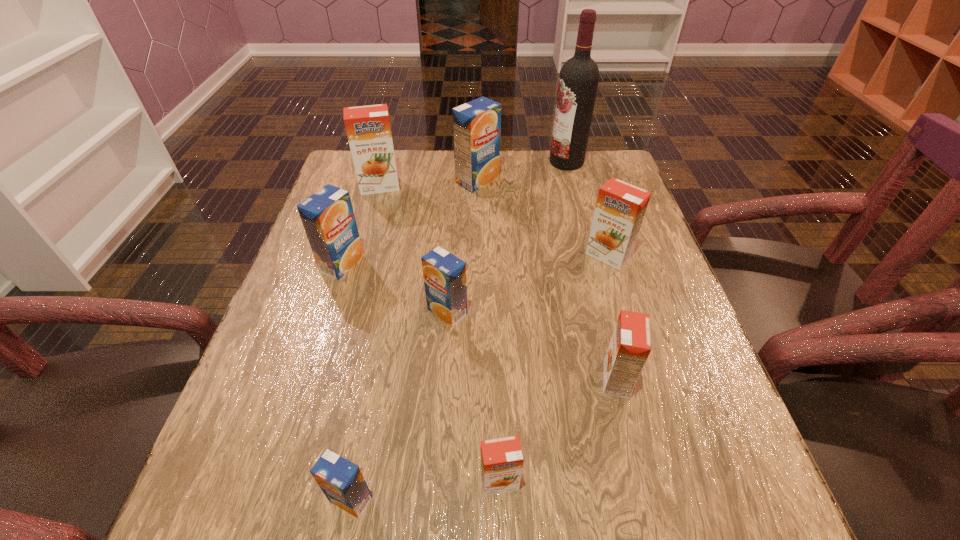
This screenshot has height=540, width=960. Find the location of `free space at the far edge of the desktop`. free space at the far edge of the desktop is located at coordinates (422, 190).

In the image, there is a desktop. What are the coordinates of `blank space at the left edge` in the screenshot? It's located at (305, 289).

Find the location of `vacant space at the right edge of the desktop`. vacant space at the right edge of the desktop is located at coordinates (641, 240).

Find the location of a particular element. Image resolution: width=960 pixels, height=540 pixels. vacant area at the far left corner is located at coordinates (342, 188).

Locate an element on the screen. The image size is (960, 540). free space at the near left corner is located at coordinates (273, 487).

This screenshot has width=960, height=540. In the image, there is a desktop. Find the location of `vacant space at the far right corner`. vacant space at the far right corner is located at coordinates (594, 166).

The height and width of the screenshot is (540, 960). In the image, there is a desktop. Find the location of `free space at the near right corner`. free space at the near right corner is located at coordinates (737, 537).

The width and height of the screenshot is (960, 540). Identify the location of vacant space that's between the third nearest blue orange_juice and the nearest blue orange_juice. (347, 381).

Image resolution: width=960 pixels, height=540 pixels. I want to click on vacant region between the second orange orange juice from left to right and the third smallest blue orange_juice, so coord(420,373).

Find the location of `vacant area that lies between the second biggest orange orange juice and the nearest orange orange juice`. vacant area that lies between the second biggest orange orange juice and the nearest orange orange juice is located at coordinates (554, 369).